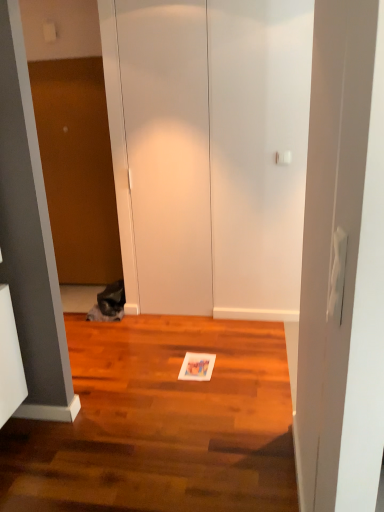
This screenshot has height=512, width=384. What are the coordinates of `blank space above brown matte door at left (from a real-world perspective)` in the screenshot? It's located at click(63, 61).